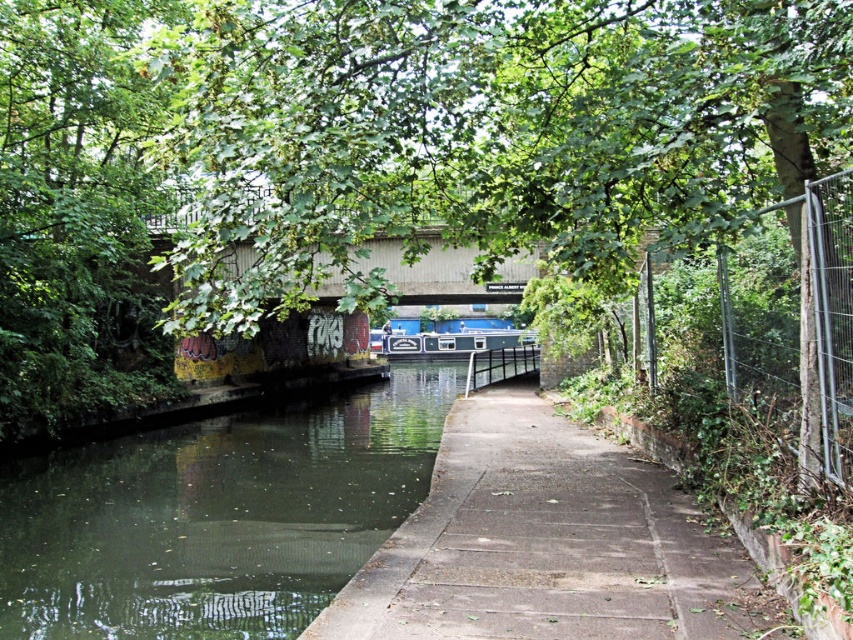
Can you confirm if concrete at center is thinner than metallic wire fence at right?

No, concrete at center is not thinner than metallic wire fence at right.

Who is more forward, (x=724, y=604) or (x=820, y=390)?

Point (x=724, y=604)

Does point (656, 490) lie in front of point (792, 339)?

No, it is not.

Locate an element on the screen. The width and height of the screenshot is (853, 640). concrete at center is located at coordinates (547, 544).

Can you confirm if metallic wire fence at right is bigger than blue glossy canal boat at center?

Incorrect, metallic wire fence at right is not larger than blue glossy canal boat at center.

Which is in front, point (764, 248) or point (511, 339)?

Point (764, 248) is more forward.

The width and height of the screenshot is (853, 640). Identify the location of metallic wire fence at right. (796, 320).

Is green concrete river at center below blue glossy canal boat at center?

Correct, green concrete river at center is located below blue glossy canal boat at center.

Does green concrete river at center lie behind blue glossy canal boat at center?

No, it is in front of blue glossy canal boat at center.

At what (x,y) coordinates should I click in order to perform the action: click on green concrete river at center. Please return your answer as a coordinate pair (x, y). This screenshot has height=640, width=853. Looking at the image, I should click on (216, 516).